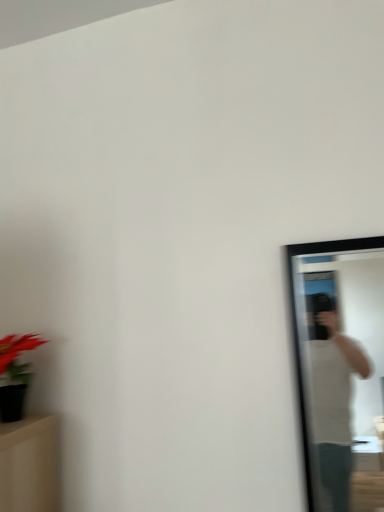
The image size is (384, 512). Find the location of `matte black vase at left`. matte black vase at left is located at coordinates (15, 374).

Image resolution: width=384 pixels, height=512 pixels. What do you see at coordinates (15, 374) in the screenshot? I see `matte black vase at left` at bounding box center [15, 374].

This screenshot has width=384, height=512. I want to click on matte black vase at left, so click(x=15, y=374).